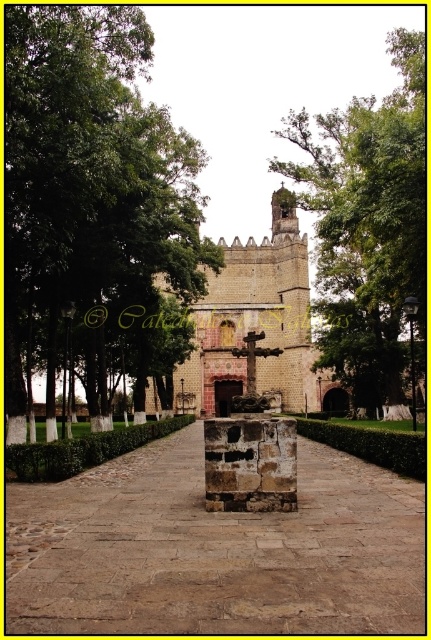
Question: Which of the following is the farthest from the observer?

Choices:
 (A) green leafy tree at center
 (B) green leafy tree at upper left

Answer: (A)

Question: Which object appears closest to the camera in this image?

Choices:
 (A) green leafy tree at upper left
 (B) green leafy tree at center

Answer: (A)

Question: Considering the relative positions of green leafy tree at upper left and green leafy tree at center in the image provided, where is green leafy tree at upper left located with respect to green leafy tree at center?

Choices:
 (A) left
 (B) right

Answer: (A)

Question: Does green leafy tree at upper left have a lesser width compared to green leafy tree at center?

Choices:
 (A) no
 (B) yes

Answer: (A)

Question: Does green leafy tree at upper left appear on the left side of green leafy tree at center?

Choices:
 (A) yes
 (B) no

Answer: (A)